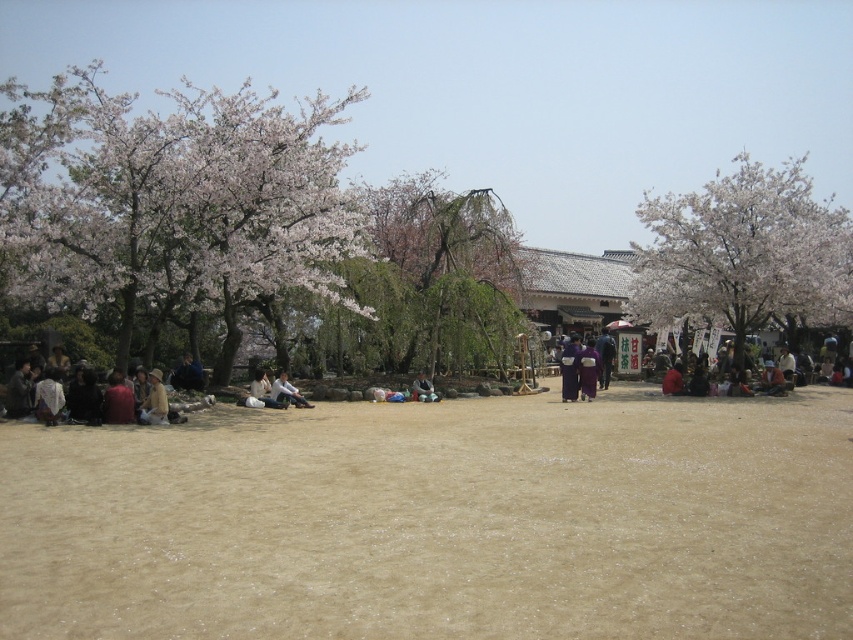
Is matte brown jacket at lower left taller than dark purple fabric at center?

In fact, matte brown jacket at lower left may be shorter than dark purple fabric at center.

Which is more to the left, matte brown jacket at lower left or dark purple fabric at center?

Positioned to the left is matte brown jacket at lower left.

Image resolution: width=853 pixels, height=640 pixels. Identify the location of matte brown jacket at lower left. (117, 401).

Where is `matte brown jacket at lower left`? matte brown jacket at lower left is located at coordinates (117, 401).

You are a GUI agent. You are given a task and a screenshot of the screen. Output one action in this format:
    pyautogui.click(x=<x>, y=<y>)
    Task: Click on the light brown fabric bag at center
    
    Given the screenshot: What is the action you would take?
    pyautogui.click(x=264, y=390)

Does light brown fabric bag at center appear over dark purple kimono at center?

Yes.

Which is behind, point (260, 371) or point (432, 387)?

Positioned behind is point (432, 387).

I want to click on light brown fabric bag at center, so click(264, 390).

Who is positioned more to the right, white blossoming tree at left or matte brown jacket at lower left?

From the viewer's perspective, matte brown jacket at lower left appears more on the right side.

Is point (170, 269) closer to viewer compared to point (114, 387)?

No, it is behind (114, 387).

Locate an element on the screen. white blossoming tree at left is located at coordinates (172, 204).